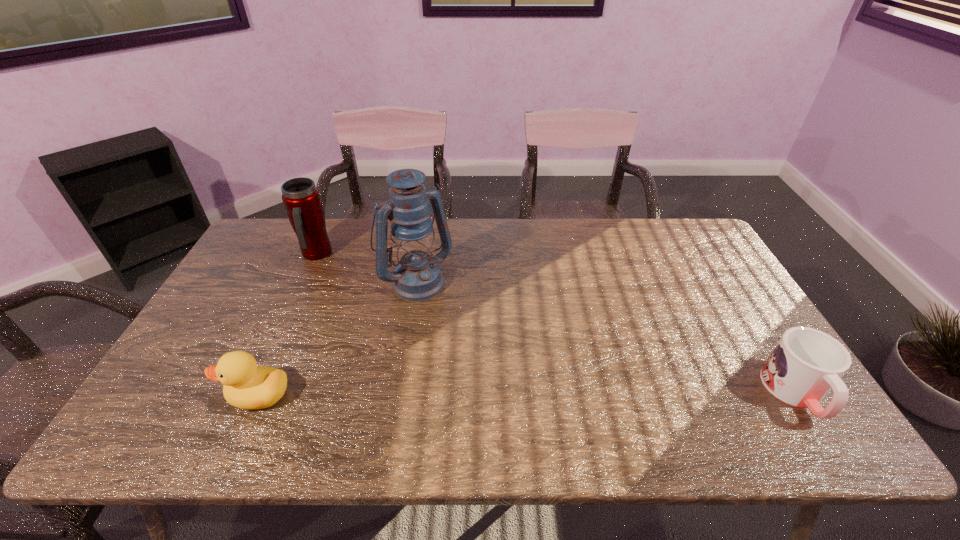
The image size is (960, 540). I want to click on duck, so click(x=247, y=386).

This screenshot has width=960, height=540. Identify the location of the rightmost object. (806, 364).

Identify the location of the second object from right to left. The image size is (960, 540). [x=417, y=277].

Identify the location of lantern. The width and height of the screenshot is (960, 540). (417, 277).

This screenshot has height=540, width=960. In order to click on the second tallest object in this screenshot , I will do `click(301, 198)`.

Find the location of a particular element. free location located 0.080m at the beak of the duck is located at coordinates (193, 395).

Find the location of a particular element. This screenshot has width=960, height=540. vacant area located at the beak of the duck is located at coordinates (172, 395).

Where is `vacant space located 0.140m at the beak of the duck`? This screenshot has height=540, width=960. vacant space located 0.140m at the beak of the duck is located at coordinates (168, 395).

This screenshot has width=960, height=540. I want to click on vacant space located 0.140m on the front-facing side of the tallest object, so click(x=459, y=328).

Find the location of a particular element. This screenshot has height=540, width=960. vacant point located on the front-facing side of the tallest object is located at coordinates (515, 392).